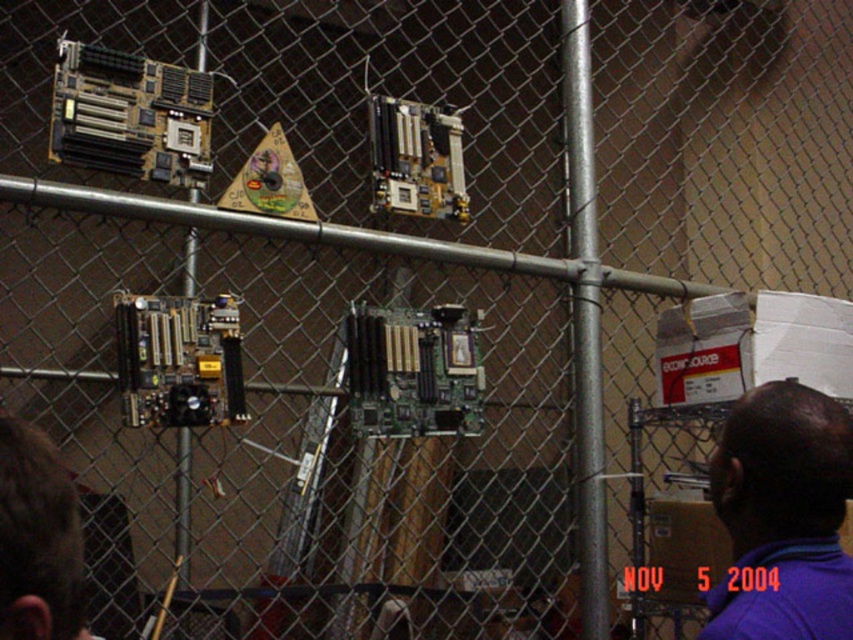
Does purple fabric shirt at upper right have a larger size compared to brown hair at lower left?

Correct, purple fabric shirt at upper right is larger in size than brown hair at lower left.

Between purple fabric shirt at upper right and brown hair at lower left, which one appears on the left side from the viewer's perspective?

Positioned to the left is brown hair at lower left.

The image size is (853, 640). What do you see at coordinates (782, 516) in the screenshot?
I see `purple fabric shirt at upper right` at bounding box center [782, 516].

What are the coordinates of `purple fabric shirt at upper right` in the screenshot? It's located at (782, 516).